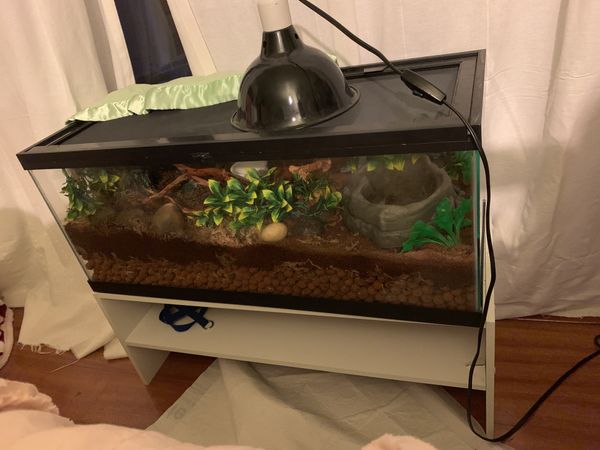
Image resolution: width=600 pixels, height=450 pixels. I want to click on plunger, so click(283, 80).